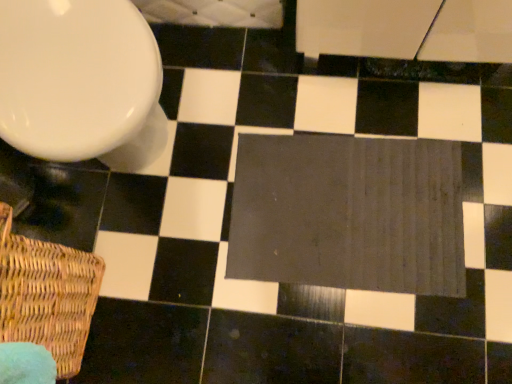
Question: Is woven brown basket at lower left spatially inside dark gray fabric bath mat at center, or outside of it?

Choices:
 (A) outside
 (B) inside

Answer: (A)

Question: In terms of width, does woven brown basket at lower left look wider or thinner when compared to dark gray fabric bath mat at center?

Choices:
 (A) thin
 (B) wide

Answer: (A)

Question: Based on their relative distances, which object is nearer to the white glossy toilet at upper left?

Choices:
 (A) dark gray fabric bath mat at center
 (B) woven brown basket at lower left

Answer: (B)

Question: Estimate the real-world distances between objects in this image. Which object is farther from the woven brown basket at lower left?

Choices:
 (A) white glossy toilet at upper left
 (B) dark gray fabric bath mat at center

Answer: (B)